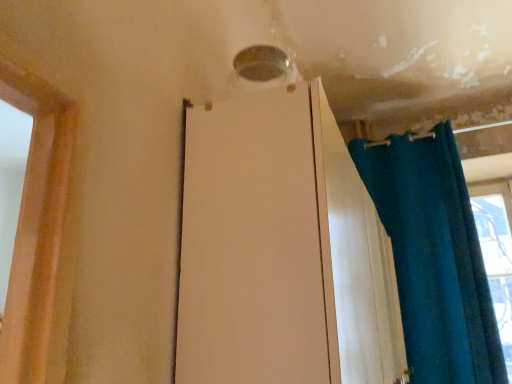
Question: In terms of height, does white matte screen door at center look taller or shorter compared to teal fabric curtain at right?

Choices:
 (A) tall
 (B) short

Answer: (B)

Question: Does point (210, 221) appear closer or farther from the camera than point (388, 157)?

Choices:
 (A) closer
 (B) farther

Answer: (A)

Question: Based on their positions, is white matte screen door at center located to the left or right of teal fabric curtain at right?

Choices:
 (A) left
 (B) right

Answer: (A)

Question: Considering the relative positions of teal fabric curtain at right and white matte screen door at center in the image provided, is teal fabric curtain at right to the left or to the right of white matte screen door at center?

Choices:
 (A) right
 (B) left

Answer: (A)

Question: In terms of width, does teal fabric curtain at right look wider or thinner when compared to white matte screen door at center?

Choices:
 (A) wide
 (B) thin

Answer: (B)

Question: Considering their positions, is teal fabric curtain at right located in front of or behind white matte screen door at center?

Choices:
 (A) behind
 (B) front

Answer: (A)

Question: Is teal fabric curtain at right situated inside white matte screen door at center or outside?

Choices:
 (A) inside
 (B) outside

Answer: (B)